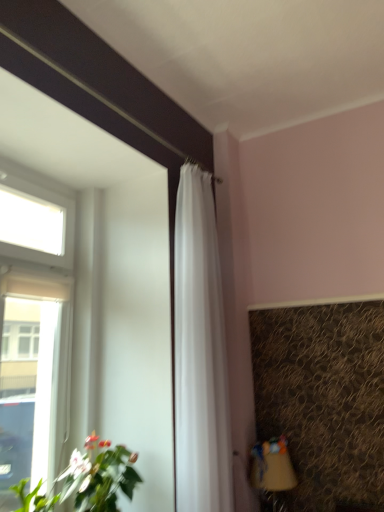
Measure the distance between point (113, 484) and camera.

The depth of point (113, 484) is 6.56 feet.

The height and width of the screenshot is (512, 384). Describe the element at coordinates (200, 353) in the screenshot. I see `white sheer curtain at center` at that location.

Locate an element on the screen. The image size is (384, 512). matte brown table lamp at lower right is located at coordinates 272,467.

At what (x,y) coordinates should I click in order to perform the action: click on green leafy plant at lower left. Please return your answer as a coordinate pair (x, y). This screenshot has width=384, height=512. Looking at the image, I should click on (88, 480).

Considering the positions of objects green leafy plant at lower left and matte brown table lamp at lower right in the image provided, who is in front, green leafy plant at lower left or matte brown table lamp at lower right?

green leafy plant at lower left.

From the picture: Is green leafy plant at lower left aimed at matte brown table lamp at lower right?

No, green leafy plant at lower left is not turned towards matte brown table lamp at lower right.

Between green leafy plant at lower left and matte brown table lamp at lower right, which one has smaller width?

matte brown table lamp at lower right.

Locate an element on the screen. This screenshot has width=384, height=512. table lamp that is below the transparent glass window at upper left (from the image's perspective) is located at coordinates (272, 467).

Is transparent glass window at upper left not close to matte brown table lamp at lower right?

Absolutely, transparent glass window at upper left is distant from matte brown table lamp at lower right.

Would you say transparent glass window at upper left contains matte brown table lamp at lower right?

No, matte brown table lamp at lower right is located outside of transparent glass window at upper left.

Considering the positions of objects white sheer curtain at center and transparent glass window at upper left in the image provided, who is more to the left, white sheer curtain at center or transparent glass window at upper left?

From the viewer's perspective, transparent glass window at upper left appears more on the left side.

From a real-world perspective, is white sheer curtain at center located beneath transparent glass window at upper left?

No, from a real-world perspective, white sheer curtain at center is not under transparent glass window at upper left.

Measure the distance from white sheer curtain at center to transparent glass window at upper left.

They are 32.77 inches apart.

Considering the relative sizes of white sheer curtain at center and transparent glass window at upper left in the image provided, is white sheer curtain at center thinner than transparent glass window at upper left?

Indeed, white sheer curtain at center has a lesser width compared to transparent glass window at upper left.

Is green leafy plant at lower left not close to transparent glass window at upper left?

That's not correct — green leafy plant at lower left is a little close to transparent glass window at upper left.

This screenshot has height=512, width=384. Find the location of `houseplant located in front of the transparent glass window at upper left`. houseplant located in front of the transparent glass window at upper left is located at coordinates (88, 480).

Is green leafy plant at lower left shorter than transparent glass window at upper left?

Yes, green leafy plant at lower left is shorter than transparent glass window at upper left.

Is white sheer curtain at center far away from green leafy plant at lower left?

No, there isn't a large distance between white sheer curtain at center and green leafy plant at lower left.

Which object is closer to the camera, white sheer curtain at center or green leafy plant at lower left?

green leafy plant at lower left is in front.

Between white sheer curtain at center and green leafy plant at lower left, which one has larger size?

Bigger between the two is white sheer curtain at center.

Looking at this image, is transparent glass window at upper left oriented away from green leafy plant at lower left?

Yes, transparent glass window at upper left is facing away from green leafy plant at lower left.

How many degrees apart are the facing directions of transparent glass window at upper left and green leafy plant at lower left?

transparent glass window at upper left and green leafy plant at lower left are facing 0.000183 degrees away from each other.

From the picture: Which of these two, transparent glass window at upper left or green leafy plant at lower left, is thinner?

With smaller width is transparent glass window at upper left.

Which object is more forward, transparent glass window at upper left or green leafy plant at lower left?

green leafy plant at lower left is closer to the camera.

Considering the positions of objects matte brown table lamp at lower right and transparent glass window at upper left in the image provided, who is more to the left, matte brown table lamp at lower right or transparent glass window at upper left?

transparent glass window at upper left is more to the left.

From a real-world perspective, does matte brown table lamp at lower right stand above transparent glass window at upper left?

No.

Is transparent glass window at upper left at the back of matte brown table lamp at lower right?

No.

Is matte brown table lamp at lower right directly adjacent to transparent glass window at upper left?

No, matte brown table lamp at lower right is not next to transparent glass window at upper left.

At what (x,y) coordinates should I click in order to perform the action: click on houseplant in front of the matte brown table lamp at lower right. Please return your answer as a coordinate pair (x, y). The width and height of the screenshot is (384, 512). Looking at the image, I should click on (88, 480).

Identify the location of table lamp that is under the transparent glass window at upper left (from a real-world perspective). The height and width of the screenshot is (512, 384). (272, 467).

Looking at the image, which one is located further to matte brown table lamp at lower right, white sheer curtain at center or green leafy plant at lower left?

green leafy plant at lower left is positioned further to the anchor matte brown table lamp at lower right.

Estimate the real-world distances between objects in this image. Which object is closer to white sheer curtain at center, transparent glass window at upper left or green leafy plant at lower left?

green leafy plant at lower left lies closer to white sheer curtain at center than the other object.

Which object lies further to the anchor point white sheer curtain at center, transparent glass window at upper left or matte brown table lamp at lower right?

transparent glass window at upper left is positioned further to the anchor white sheer curtain at center.

Which object lies further to the anchor point transparent glass window at upper left, green leafy plant at lower left or matte brown table lamp at lower right?

matte brown table lamp at lower right is positioned further to the anchor transparent glass window at upper left.

When comparing their distances from transparent glass window at upper left, does white sheer curtain at center or matte brown table lamp at lower right seem further?

matte brown table lamp at lower right is positioned further to the anchor transparent glass window at upper left.

From the image, which object appears to be farther from matte brown table lamp at lower right, transparent glass window at upper left or white sheer curtain at center?

Based on the image, transparent glass window at upper left appears to be further to matte brown table lamp at lower right.

When comparing their distances from green leafy plant at lower left, does matte brown table lamp at lower right or white sheer curtain at center seem closer?

The object closer to green leafy plant at lower left is white sheer curtain at center.

When comparing their distances from white sheer curtain at center, does green leafy plant at lower left or matte brown table lamp at lower right seem further?

matte brown table lamp at lower right lies further to white sheer curtain at center than the other object.

Locate an element on the screen. houseplant between white sheer curtain at center and matte brown table lamp at lower right from top to bottom is located at coordinates pos(88,480).

Locate an element on the screen. The width and height of the screenshot is (384, 512). houseplant located between transparent glass window at upper left and white sheer curtain at center in the left-right direction is located at coordinates (88, 480).

Find the location of a particular element. This screenshot has width=384, height=512. curtain between transparent glass window at upper left and matte brown table lamp at lower right is located at coordinates (200, 353).

This screenshot has width=384, height=512. What are the coordinates of `houseplant between transparent glass window at upper left and matte brown table lamp at lower right` in the screenshot? It's located at tap(88, 480).